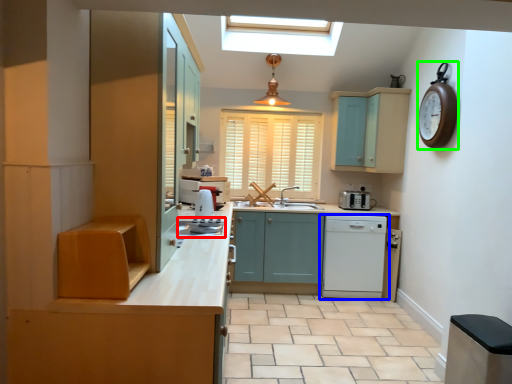
Question: Based on their relative distances, which object is nearer to appliance (highlighted by a red box)? Choose from home appliance (highlighted by a blue box) and clock (highlighted by a green box).

Choices:
 (A) home appliance
 (B) clock

Answer: (A)